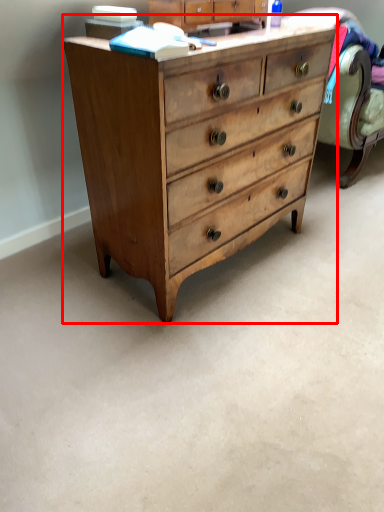
Question: Considering the relative positions of chest of drawers (annotated by the red box) and cabinetry in the image provided, where is chest of drawers (annotated by the red box) located with respect to the staircase?

Choices:
 (A) left
 (B) right

Answer: (A)